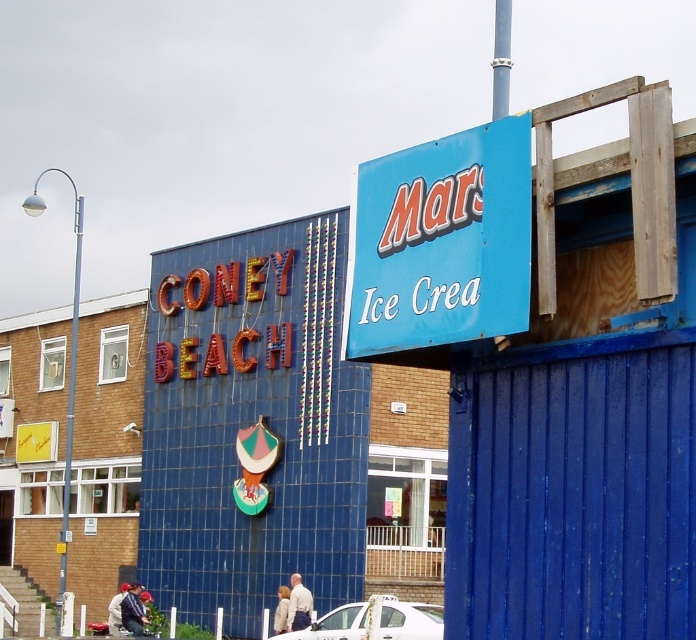
You are a photographer trying to capture both the blue matte sign at upper right and the white glossy car at lower center in a single frame. Given that your camera can only focus on objects within a 10 meter width, can you fit both in the frame without moving?

The blue matte sign at upper right is wider than the white glossy car at lower center. Since the camera can focus on objects within a 10 meter width, and the combined width of both objects would depend on their actual sizes and distances, but the description only states the sign is wider, not the total width. However, without specific distance or total size info, it is impossible to determine if they fit within the 10 meter limit based on the given data.

You are a photographer standing in front of the building with the blue tiles. You want to capture both the blue matte sign at upper right and the white glossy car at lower center in a single photo. Which object will appear larger in the photo?

The blue matte sign at upper right will appear larger in the photo because it is bigger than the white glossy car at lower center according to the description.